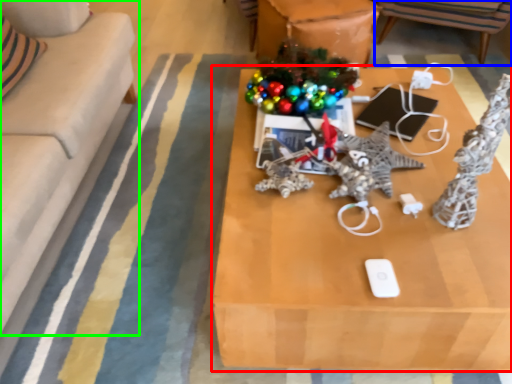
Question: Which object is the farthest from table (highlighted by a red box)? Choose among these: chair (highlighted by a blue box) or studio couch (highlighted by a green box).

Choices:
 (A) chair
 (B) studio couch

Answer: (A)